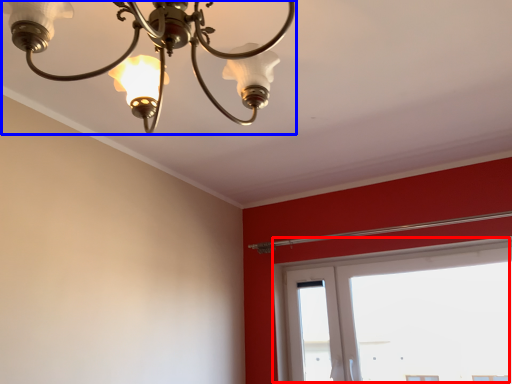
Question: Which point is closer to the camera, window (highlighted by a red box) or lamp (highlighted by a blue box)?

Choices:
 (A) window
 (B) lamp

Answer: (B)